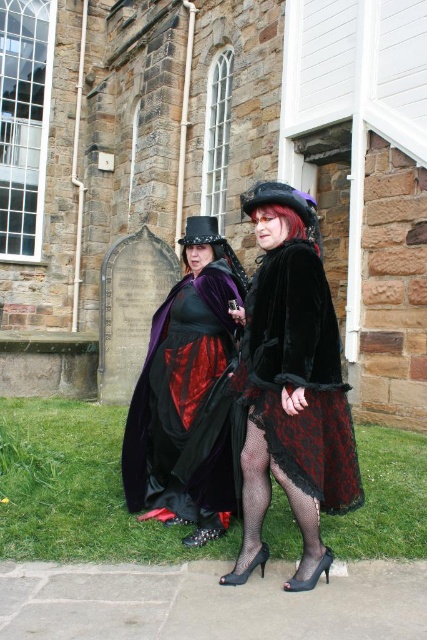
Question: Does velvet black coat at center appear under velvet/black lace dress at center?

Choices:
 (A) yes
 (B) no

Answer: (B)

Question: Which point is closer to the camera?

Choices:
 (A) velvet black coat at center
 (B) velvet/black dress at center

Answer: (B)

Question: Can you confirm if velvet/black dress at center is positioned to the right of velvet/black lace dress at center?

Choices:
 (A) yes
 (B) no

Answer: (B)

Question: Does velvet/black dress at center lie behind velvet black coat at center?

Choices:
 (A) no
 (B) yes

Answer: (A)

Question: Which point is farther from the camera taking this photo?

Choices:
 (A) (181, 388)
 (B) (245, 348)
 (C) (268, 282)

Answer: (A)

Question: Estimate the real-world distances between objects in this image. Which object is closer to the velvet/black dress at center?

Choices:
 (A) velvet/black lace dress at center
 (B) velvet black coat at center

Answer: (B)